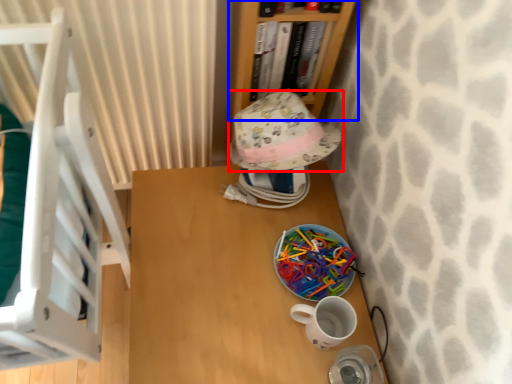
Question: Which object appears closest to the camera in this image, hat (highlighted by a red box) or bookcase (highlighted by a blue box)?

Choices:
 (A) hat
 (B) bookcase

Answer: (B)